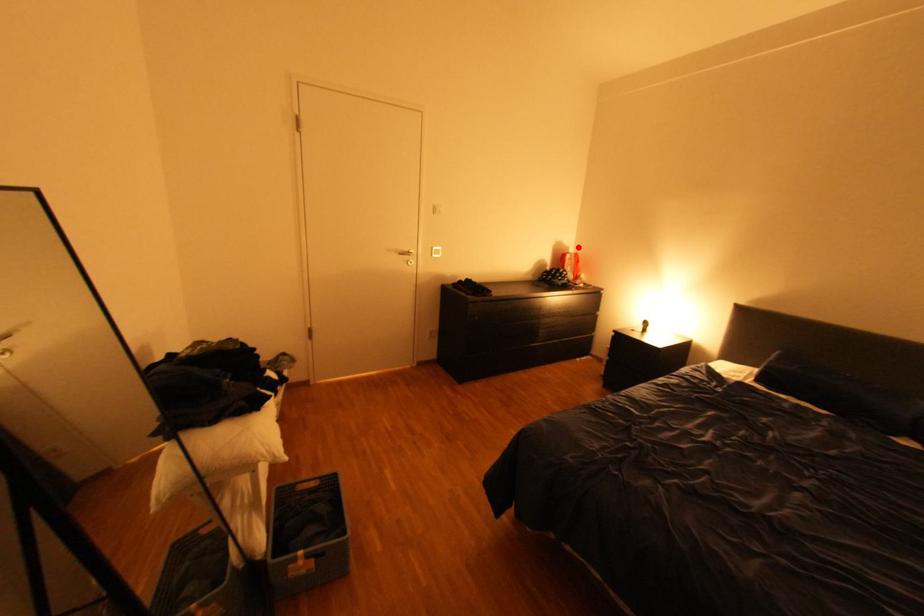
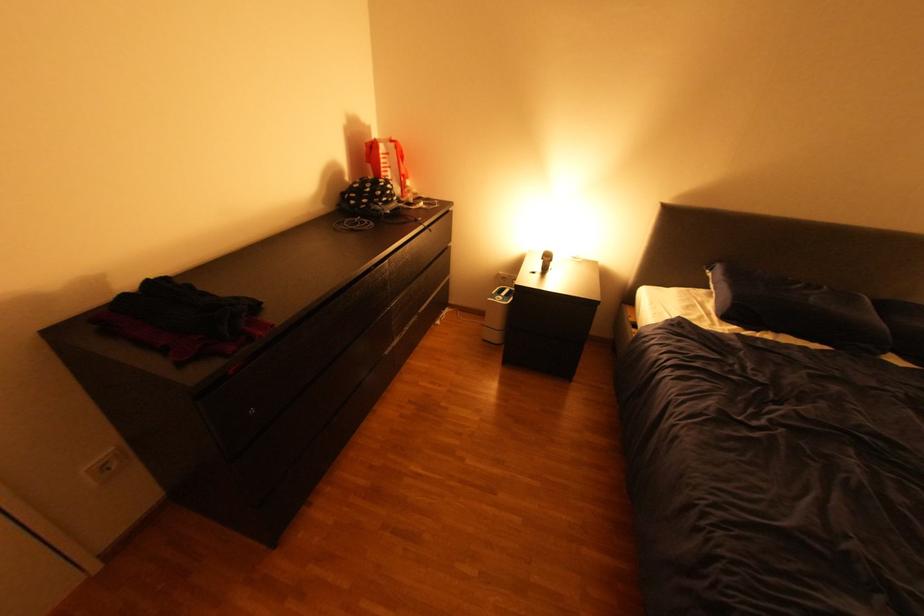
Question: I am providing you with two images of the same scene from different viewpoints. A red point is marked on the first image. Can you still see the location of the red point in image 2?

Choices:
 (A) Yes
 (B) No

Answer: (A)